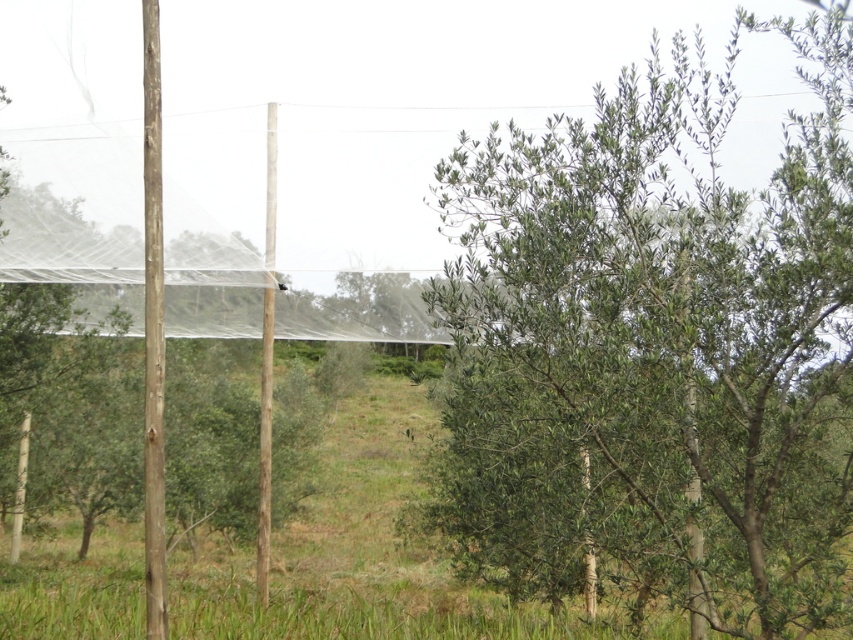
You are standing in the middle of an olive grove and see a green leafy tree at center and a brown wood pole at center. Which object is located to the right of the other?

The green leafy tree at center is positioned on the right side of brown wood pole at center.

You are a farmer checking the irrigation system in the agricultural field. You see the brown rough wooden pole at left and the brown wood pole at center. Which pole do you need to adjust the height of to match the other?

The brown rough wooden pole at left has a lesser height compared to brown wood pole at center, so you should adjust the height of the brown rough wooden pole at left to match the brown wood pole at center.

You are standing at the point with coordinates point (268, 177) and want to walk towards the point with coordinates point (479, 202). Will you pass through any obstacles in your path?

Since point (479, 202) is in front of point (268, 177), you will not encounter any obstacles between them as you move towards the desired point.